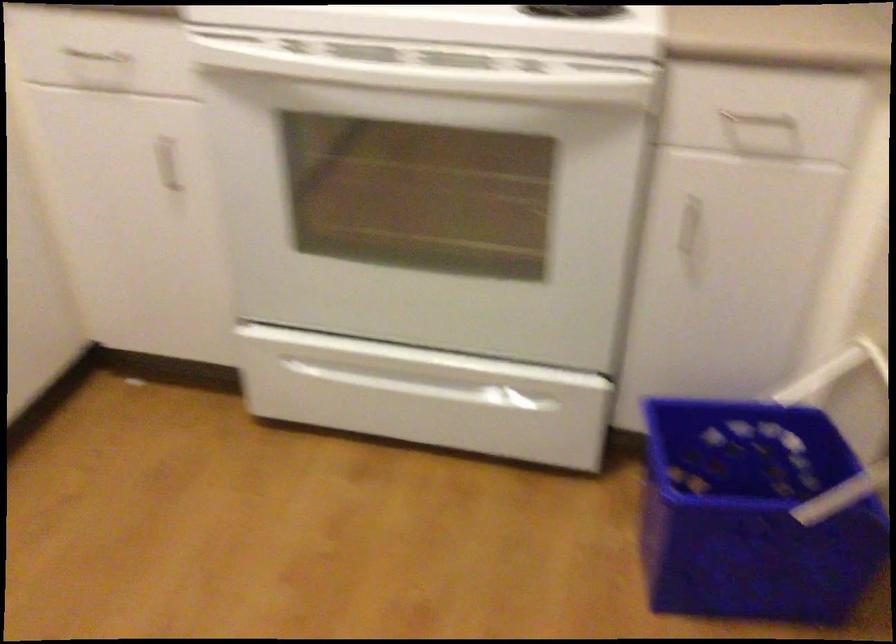
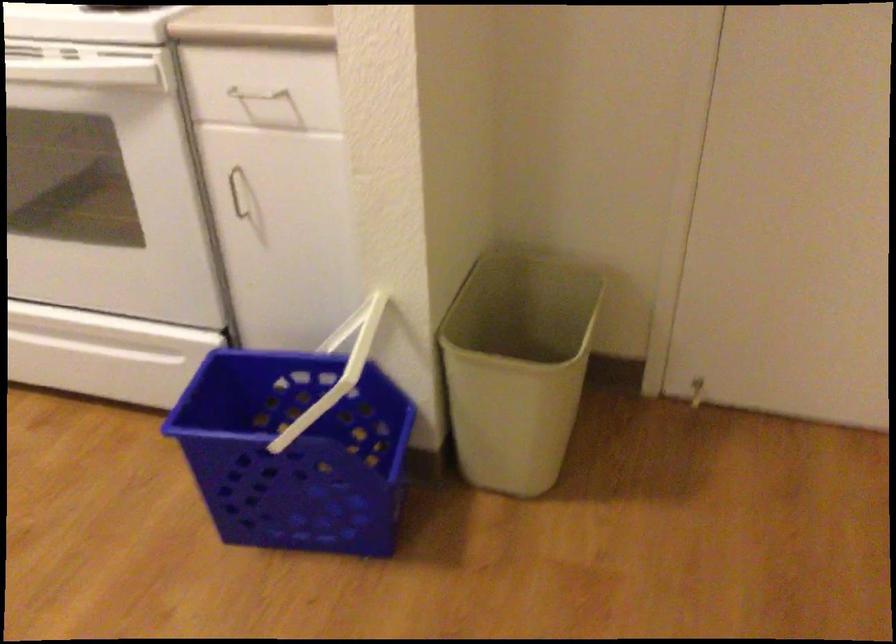
The point at (x=512, y=210) is marked in the first image. Where is the corresponding point in the second image?

(104, 185)